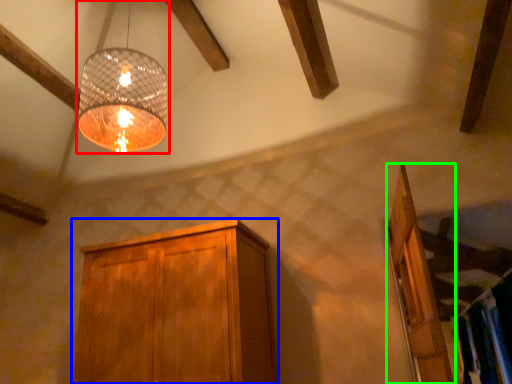
Question: Which object is positioned closest to lamp (highlighted by a red box)? Select from cabinetry (highlighted by a blue box) and door (highlighted by a green box).

Choices:
 (A) cabinetry
 (B) door

Answer: (A)